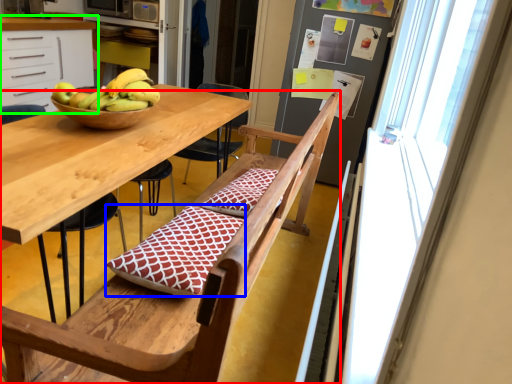
Question: Considering the real-world distances, which object is farthest from chair (highlighted by a red box)? quilt (highlighted by a blue box) or cabinetry (highlighted by a green box)?

Choices:
 (A) quilt
 (B) cabinetry

Answer: (B)